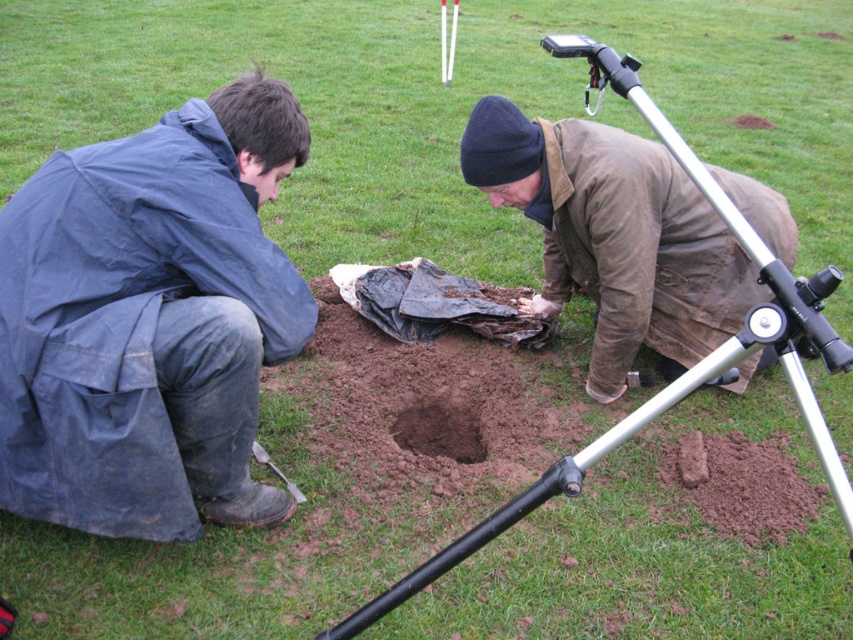
You are a photographer trying to capture both the brown leather jacket at center and the black plastic video camera at upper center in a single frame. Based on their sizes, which object will appear larger in the photo?

The brown leather jacket at center will appear larger in the photo because its width surpasses that of the black plastic video camera at upper center.

You are an archaeologist working on this site. You need to place the black plastic video camera at upper center into the brown dirt hole at center for documentation. Can the camera fit inside the hole?

The brown dirt hole at center is larger in size than the black plastic video camera at upper center, so yes, the camera can fit inside the hole.

You are an archaeologist who needs to place a marker at the location of the brown dirt hole at center. Where should you place it in relation to the black plastic video camera at upper center?

The brown dirt hole at center is positioned on the left side of the black plastic video camera at upper center, so you should place the marker to the left of the camera.